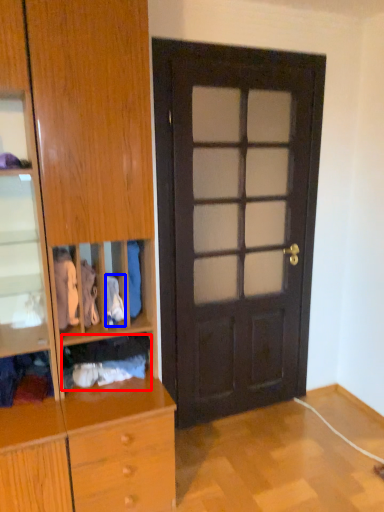
Question: Which point is further to the camera, clothing (highlighted by a red box) or clothing (highlighted by a blue box)?

Choices:
 (A) clothing
 (B) clothing

Answer: (A)